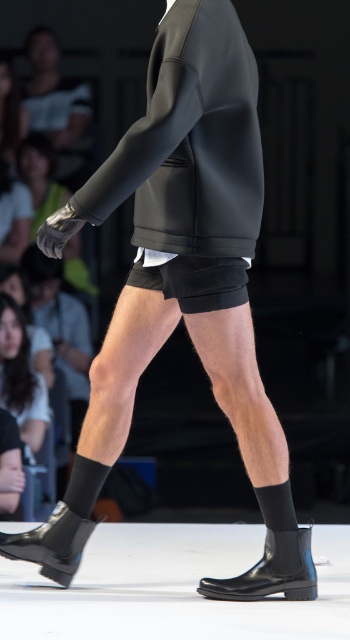
Question: Which point appears farthest from the camera in this image?

Choices:
 (A) (38, 544)
 (B) (220, 269)
 (C) (234, 596)
 (D) (192, 202)

Answer: (A)

Question: Which object appears farthest from the camera in this image?

Choices:
 (A) matte black shorts at center
 (B) black leather boot at lower center
 (C) black matte shorts at center

Answer: (C)

Question: Which point is farther to the camera?

Choices:
 (A) matte black shorts at center
 (B) black matte shorts at center
 (C) black rubber boot at lower left
 (D) black leather boot at lower center

Answer: (C)

Question: Does matte black shorts at center appear on the left side of black rubber boot at lower left?

Choices:
 (A) yes
 (B) no

Answer: (B)

Question: Where is matte black shorts at center located in relation to black rubber boot at lower left in the image?

Choices:
 (A) left
 (B) right

Answer: (B)

Question: Does matte black shorts at center have a greater width compared to black rubber boot at lower left?

Choices:
 (A) yes
 (B) no

Answer: (A)